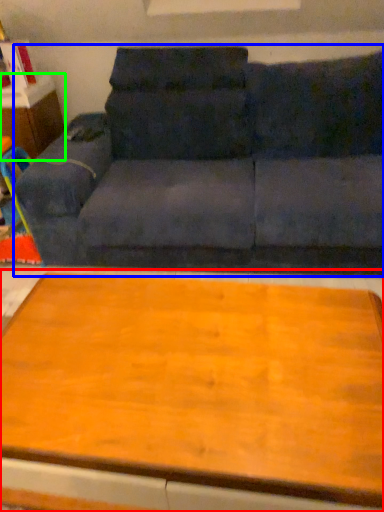
Question: Which is nearer to the table (highlighted by a red box)? studio couch (highlighted by a blue box) or dresser (highlighted by a green box).

Choices:
 (A) studio couch
 (B) dresser

Answer: (A)